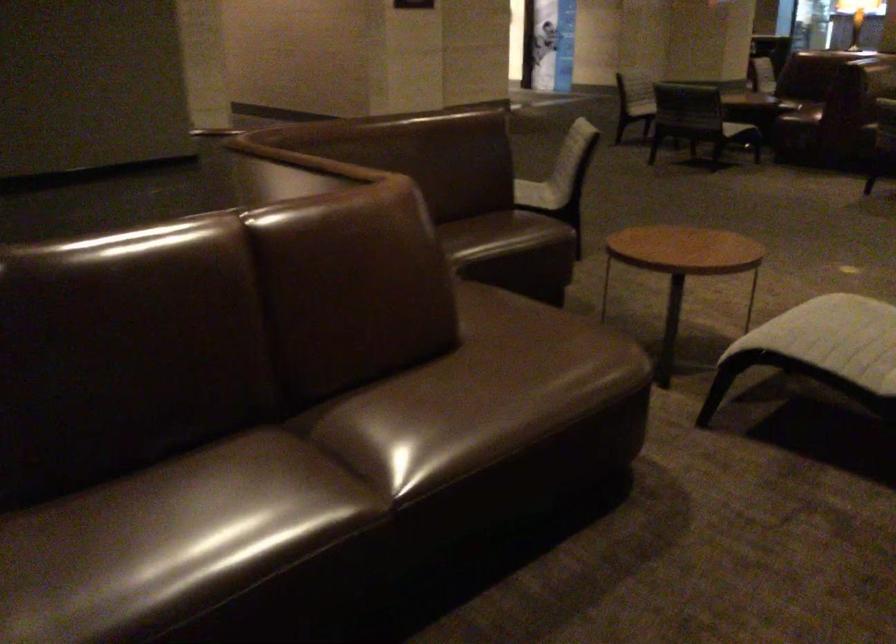
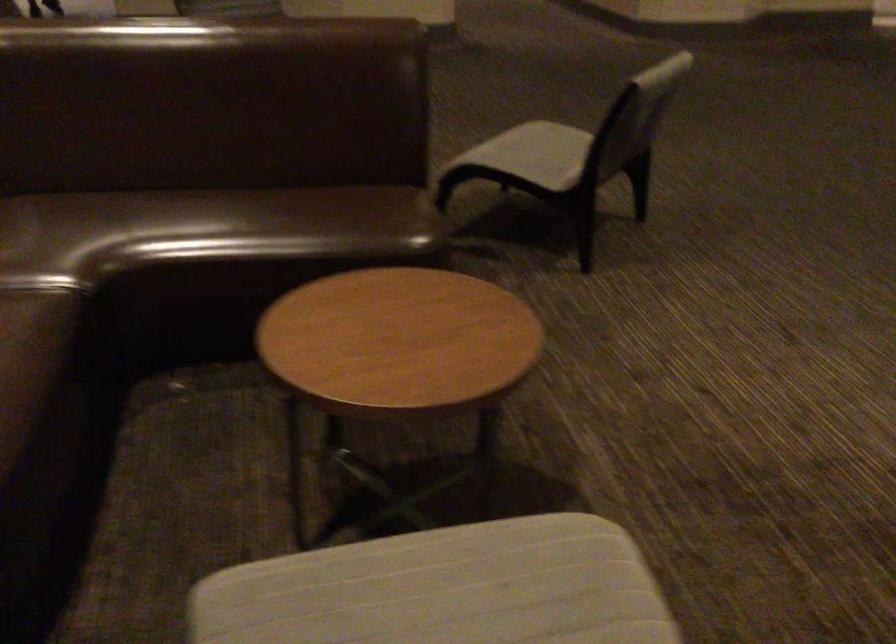
Find the pixel in the second image that matches the point at 531,182 in the first image.

(533, 154)